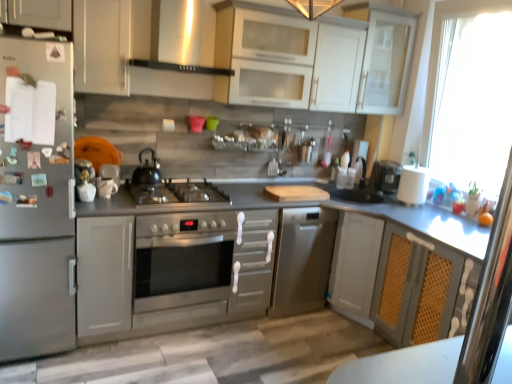
Question: Is the surface of stainless steel oven at center in direct contact with black matte kettle at center?

Choices:
 (A) yes
 (B) no

Answer: (B)

Question: Can you confirm if stainless steel oven at center is positioned to the left of black matte kettle at center?

Choices:
 (A) no
 (B) yes

Answer: (A)

Question: Is stainless steel oven at center positioned in front of black matte kettle at center?

Choices:
 (A) yes
 (B) no

Answer: (A)

Question: Is stainless steel oven at center further to the viewer compared to black matte kettle at center?

Choices:
 (A) no
 (B) yes

Answer: (A)

Question: Is stainless steel oven at center smaller than black matte kettle at center?

Choices:
 (A) no
 (B) yes

Answer: (A)

Question: From the image's perspective, is stainless steel oven at center below black matte kettle at center?

Choices:
 (A) yes
 (B) no

Answer: (A)

Question: Does transparent glass window at right lie behind black matte exhaust hood at upper center?

Choices:
 (A) yes
 (B) no

Answer: (A)

Question: Is transparent glass window at right looking in the opposite direction of black matte exhaust hood at upper center?

Choices:
 (A) yes
 (B) no

Answer: (B)

Question: From a real-world perspective, is transparent glass window at right located higher than black matte exhaust hood at upper center?

Choices:
 (A) yes
 (B) no

Answer: (B)

Question: Considering the relative sizes of transparent glass window at right and black matte exhaust hood at upper center in the image provided, is transparent glass window at right smaller than black matte exhaust hood at upper center?

Choices:
 (A) no
 (B) yes

Answer: (A)

Question: From the image's perspective, is transparent glass window at right under black matte exhaust hood at upper center?

Choices:
 (A) yes
 (B) no

Answer: (A)

Question: Can you confirm if transparent glass window at right is taller than black matte exhaust hood at upper center?

Choices:
 (A) no
 (B) yes

Answer: (B)

Question: From the image's perspective, is transparent glass window at right under transparent glass cabinet at upper right?

Choices:
 (A) yes
 (B) no

Answer: (A)